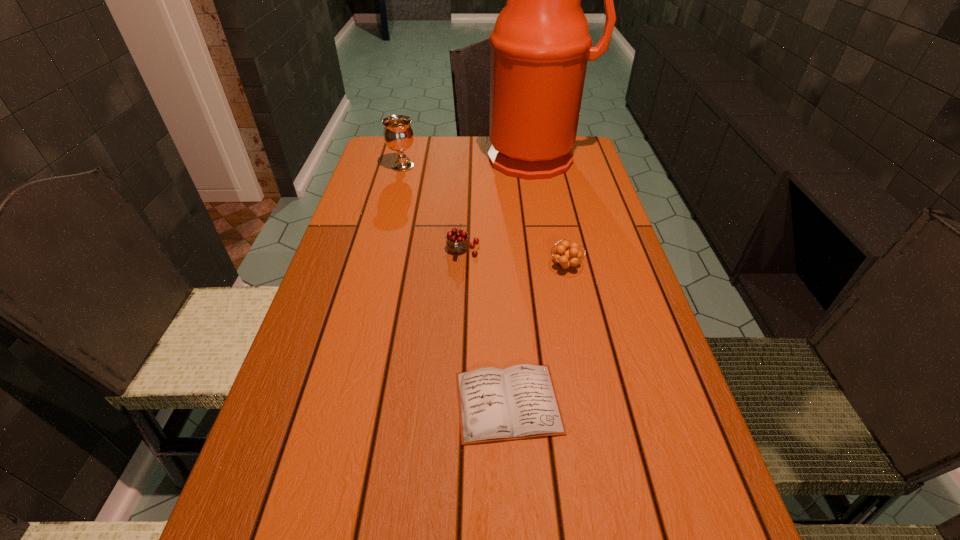
Identify the location of blank area located on the back of the second shortest object. This screenshot has width=960, height=540. (555, 215).

This screenshot has width=960, height=540. I want to click on free space located on the right of the nearest object, so click(639, 403).

I want to click on water jug that is at the far edge, so click(x=540, y=45).

The image size is (960, 540). I want to click on chalice situated at the far edge, so click(398, 135).

Where is `object located in the left edge section of the desktop`? object located in the left edge section of the desktop is located at coordinates (398, 135).

The width and height of the screenshot is (960, 540). I want to click on water jug that is positioned at the right edge, so click(540, 45).

Where is `orange fruit that is at the right edge`? orange fruit that is at the right edge is located at coordinates (571, 256).

The width and height of the screenshot is (960, 540). In order to click on object positioned at the far left corner in this screenshot , I will do `click(398, 135)`.

Locate an element on the screen. This screenshot has height=540, width=960. object at the far right corner is located at coordinates (540, 45).

Find the location of a particular element. vacant space at the far edge of the desktop is located at coordinates (430, 144).